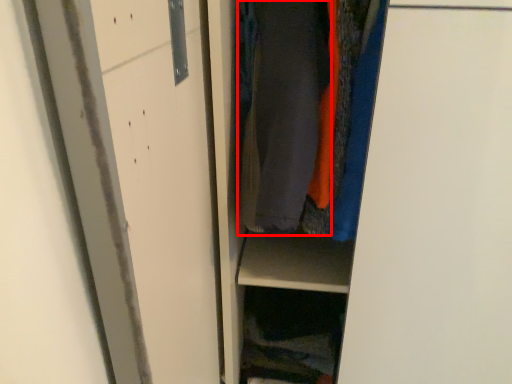
Question: From the image's perspective, what is the correct spatial relationship of garment (annotated by the red box) in relation to cabinet?

Choices:
 (A) above
 (B) below

Answer: (A)